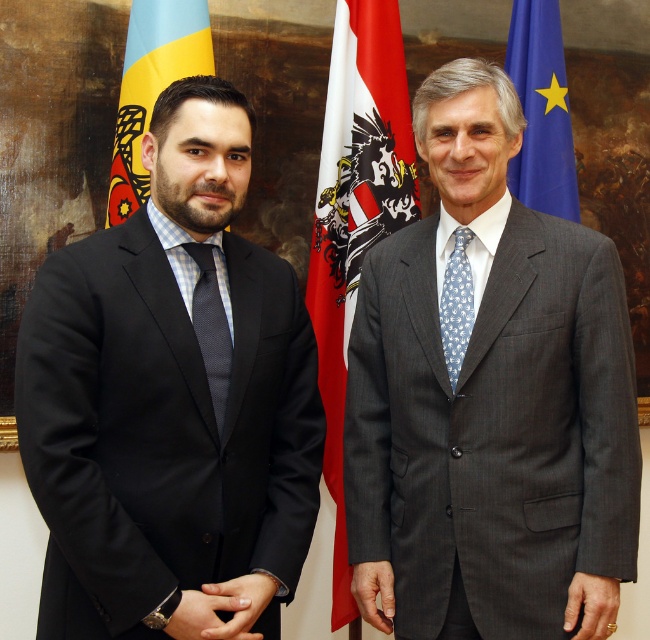
Question: Which of the following is the closest to the observer?

Choices:
 (A) (208, 259)
 (B) (468, 260)
 (C) (124, 140)

Answer: (A)

Question: Can you confirm if black matte suit at left is positioned to the right of dark blue textured tie at center?

Choices:
 (A) no
 (B) yes

Answer: (A)

Question: Does gray textured suit at center have a smaller size compared to red/white fabric flag at center?

Choices:
 (A) no
 (B) yes

Answer: (A)

Question: Estimate the real-world distances between objects in this image. Which object is closer to the dark blue textured tie at center?

Choices:
 (A) blue dotted fabric tie at center
 (B) gray textured suit at center
 (C) black matte suit at left
 (D) blue fabric flag at upper right

Answer: (C)

Question: Does black matte suit at left appear on the left side of red/white fabric flag at center?

Choices:
 (A) yes
 (B) no

Answer: (A)

Question: Which object appears farthest from the camera in this image?

Choices:
 (A) dark blue textured tie at center
 (B) gray textured suit at center
 (C) blue dotted fabric tie at center

Answer: (C)